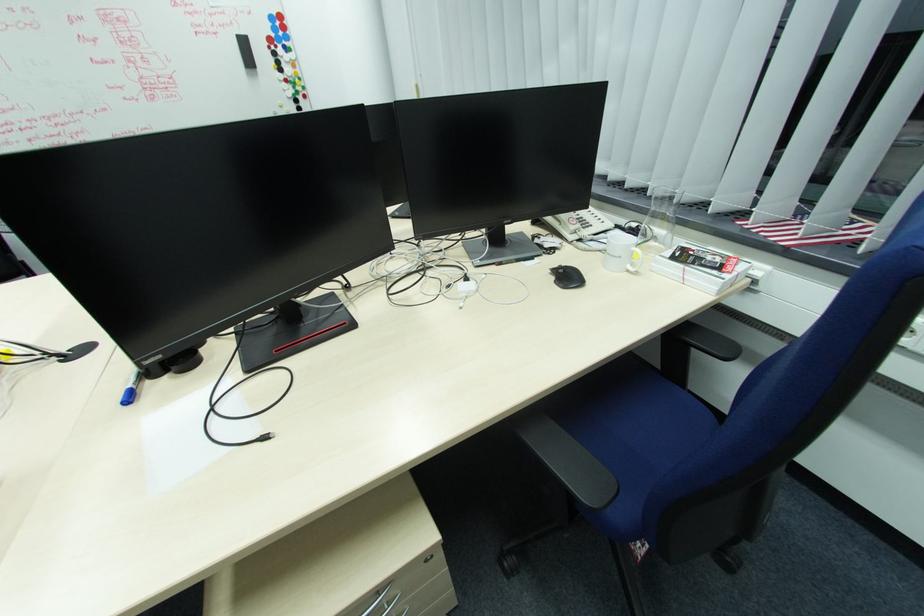
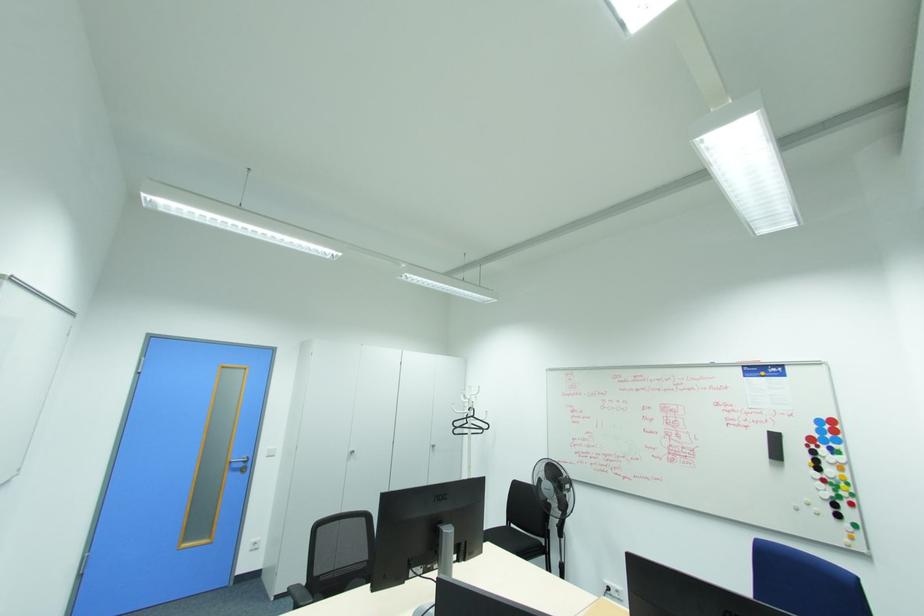
Question: The images are taken continuously from a first-person perspective. In which direction is your viewpoint rotating?

Choices:
 (A) Left
 (B) Right
 (C) Up
 (D) Down

Answer: (A)